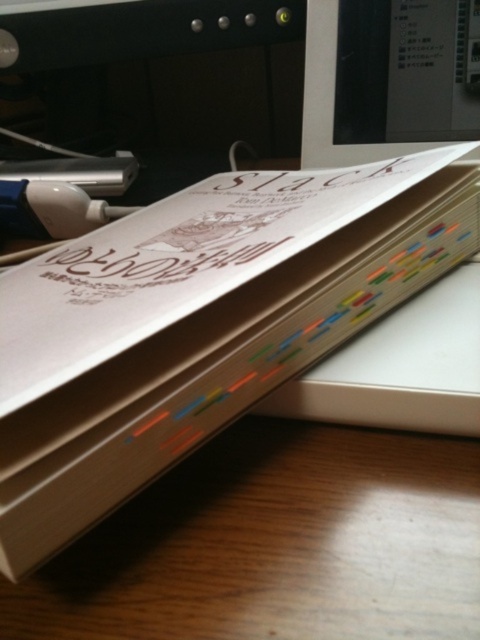
Is beige paper book at center further to camera compared to matte plastic computer monitor at upper right?

No, it is in front of matte plastic computer monitor at upper right.

Who is shorter, beige paper book at center or matte plastic computer monitor at upper right?

matte plastic computer monitor at upper right is shorter.

Locate an element on the screen. The image size is (480, 640). beige paper book at center is located at coordinates (197, 324).

The image size is (480, 640). In order to click on beige paper book at center in this screenshot , I will do `click(197, 324)`.